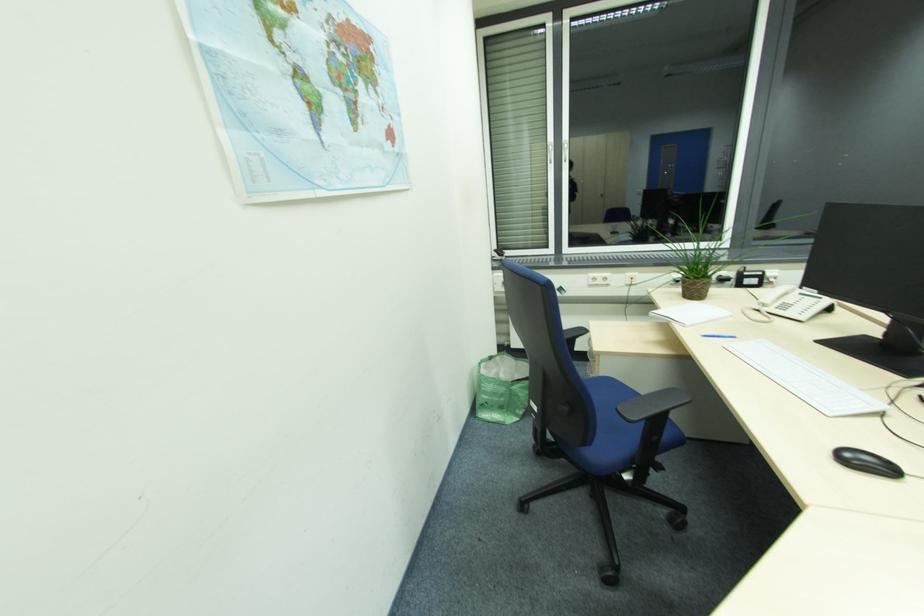
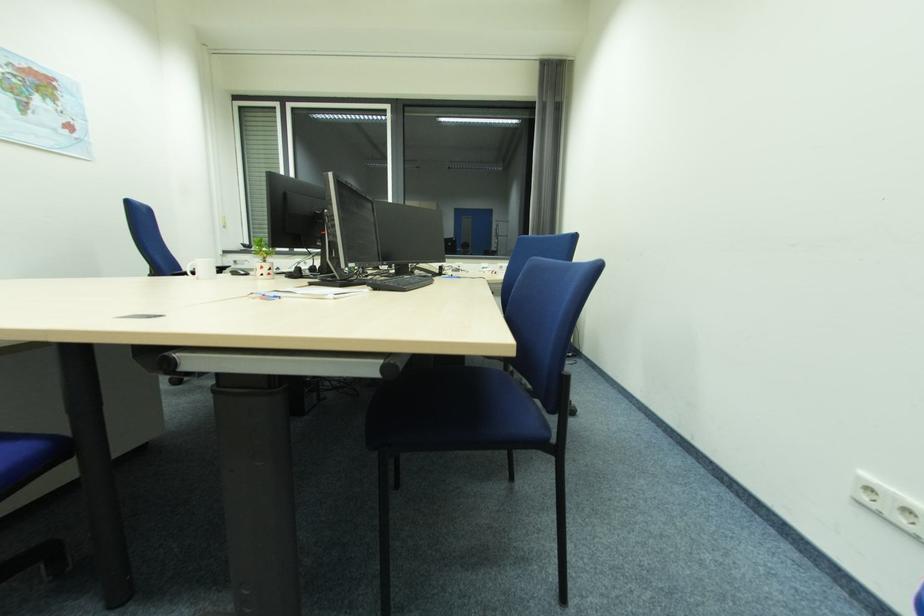
The images are taken continuously from a first-person perspective. In which direction are you moving?

The cameraman walked toward right, backward.